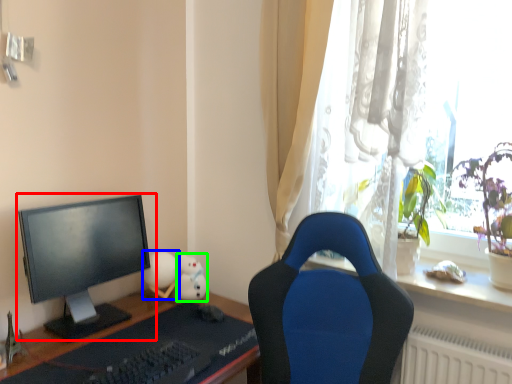
Question: Which object is the farthest from computer monitor (highlighted by a red box)? Choose among these: toy (highlighted by a blue box) or toy (highlighted by a green box).

Choices:
 (A) toy
 (B) toy

Answer: (B)